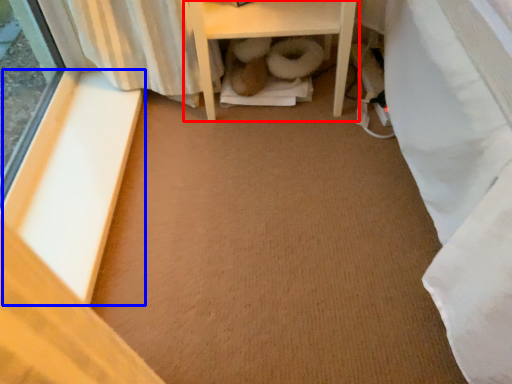
Question: Which object appears farthest to the camera in this image, furniture (highlighted by a red box) or window sill (highlighted by a blue box)?

Choices:
 (A) furniture
 (B) window sill

Answer: (A)